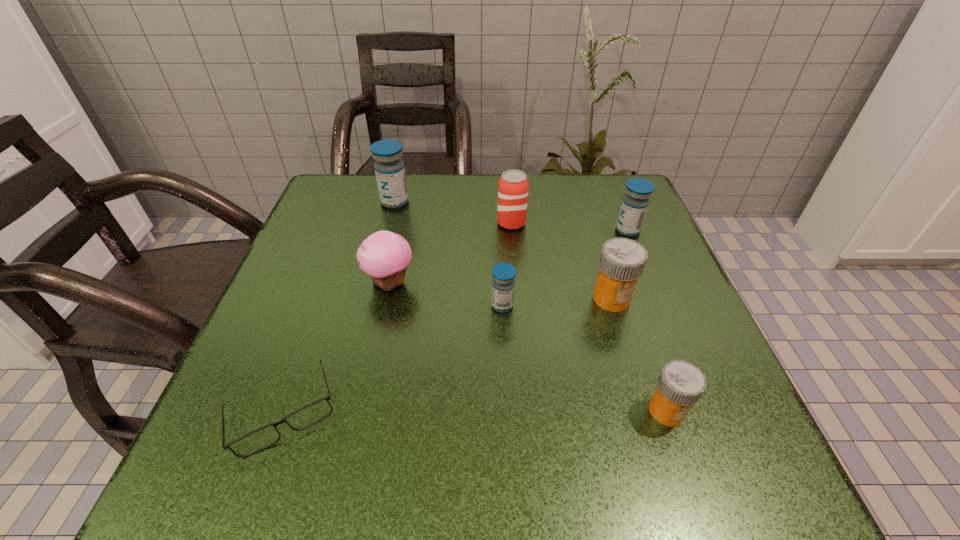
Identify the location of object identified as the third closest to the orange beer can. pyautogui.click(x=384, y=255).

Choose which object is the fifth nearest neighbor to the orange beer can. Please provide its 2D coordinates. Your answer should be formatted as a tuple, i.e. [(x, y)], where the tuple contains the x and y coordinates of a point satisfying the conditions above.

[(389, 168)]

At what (x,y) coordinates should I click in order to perform the action: click on the third closest medicine to the orange beer can. Please return your answer as a coordinate pair (x, y). The height and width of the screenshot is (540, 960). Looking at the image, I should click on (503, 283).

Where is `medicine that is the nearest to the bigger orange medicine`? Image resolution: width=960 pixels, height=540 pixels. medicine that is the nearest to the bigger orange medicine is located at coordinates (503, 283).

Choose which blue medicine is the nearest neighbor to the leftmost blue medicine. Please provide its 2D coordinates. Your answer should be formatted as a tuple, i.e. [(x, y)], where the tuple contains the x and y coordinates of a point satisfying the conditions above.

[(503, 283)]

Point out which blue medicine is positioned as the nearest to the smaller orange medicine. Please provide its 2D coordinates. Your answer should be formatted as a tuple, i.e. [(x, y)], where the tuple contains the x and y coordinates of a point satisfying the conditions above.

[(503, 283)]

Where is `vacant space that satisfies the following two spatial constraints: 1. on the front side of the orange beer can; 2. on the left side of the farthest object`? The width and height of the screenshot is (960, 540). vacant space that satisfies the following two spatial constraints: 1. on the front side of the orange beer can; 2. on the left side of the farthest object is located at coordinates (389, 224).

The image size is (960, 540). I want to click on blank area in the image that satisfies the following two spatial constraints: 1. on the back side of the beer can; 2. on the left side of the smallest blue medicine, so click(x=498, y=224).

Where is `vacant space that satisfies the following two spatial constraints: 1. on the back side of the second blue medicine from right to left; 2. on the right side of the orange beer can`? vacant space that satisfies the following two spatial constraints: 1. on the back side of the second blue medicine from right to left; 2. on the right side of the orange beer can is located at coordinates (498, 224).